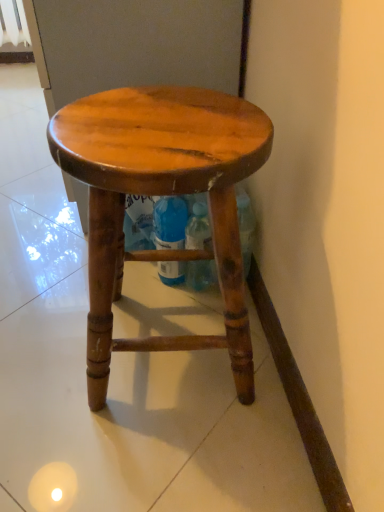
The image size is (384, 512). I want to click on free point above wooden stool at center (from a real-world perspective), so click(x=156, y=116).